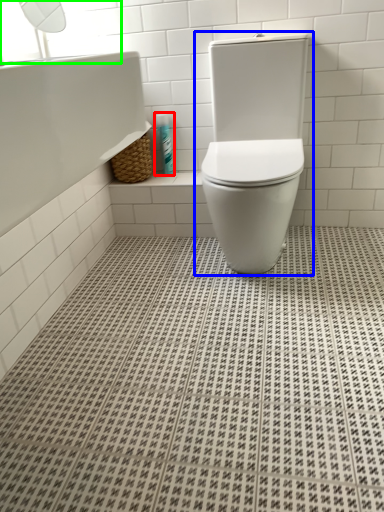
Question: Estimate the real-world distances between objects in this image. Which object is farther from toiletry (highlighted by a red box), toilet (highlighted by a blue box) or window screen (highlighted by a green box)?

Choices:
 (A) toilet
 (B) window screen

Answer: (B)